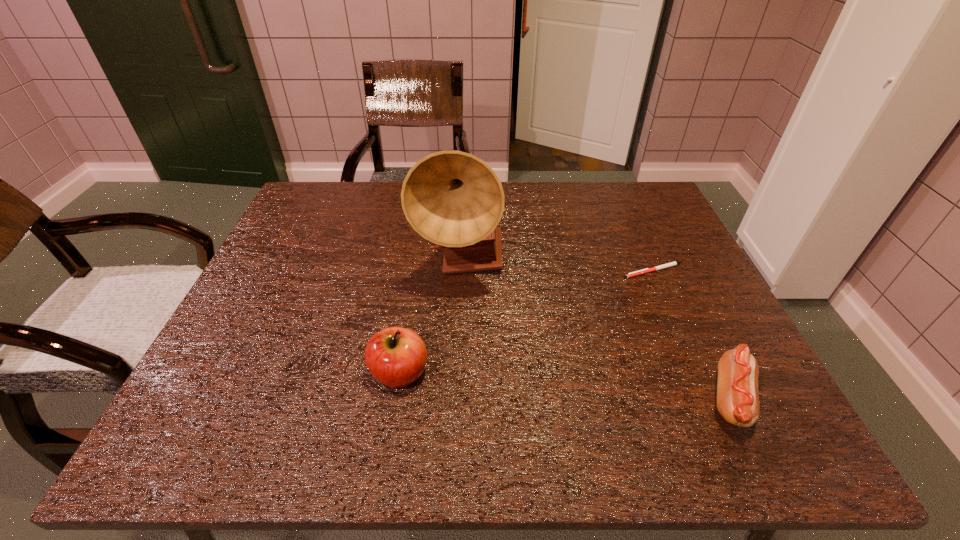
Where is `free spot on the desktop that is between the second tallest object and the second shortest object and is positioned on the clicker of the shortest object`? free spot on the desktop that is between the second tallest object and the second shortest object and is positioned on the clicker of the shortest object is located at coordinates (565, 386).

At what (x,y) coordinates should I click in order to perform the action: click on vacant space on the desktop that is between the apple and the sausage and is positioned on the horn of the tallest object. Please return your answer as a coordinate pair (x, y). Looking at the image, I should click on (556, 386).